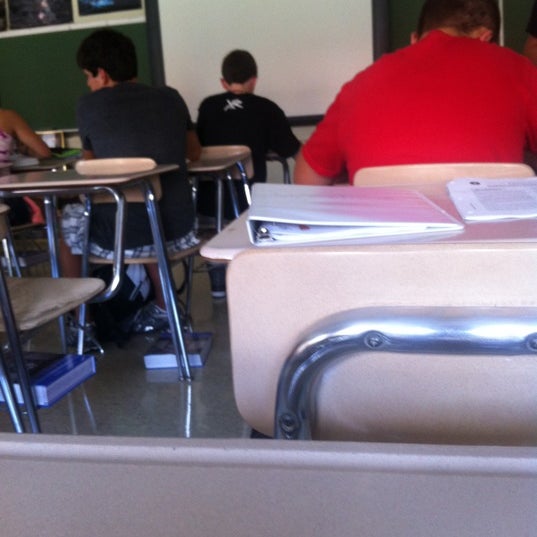
Point to any what the teacher writes on with chalk in the image. Your answer should be formatted as a list of tuples, i.e. [(x1, y1), (x2, y2), ...], where each tuple contains the x and y coordinates of a point satisfying the conditions above.

[(52, 68)]